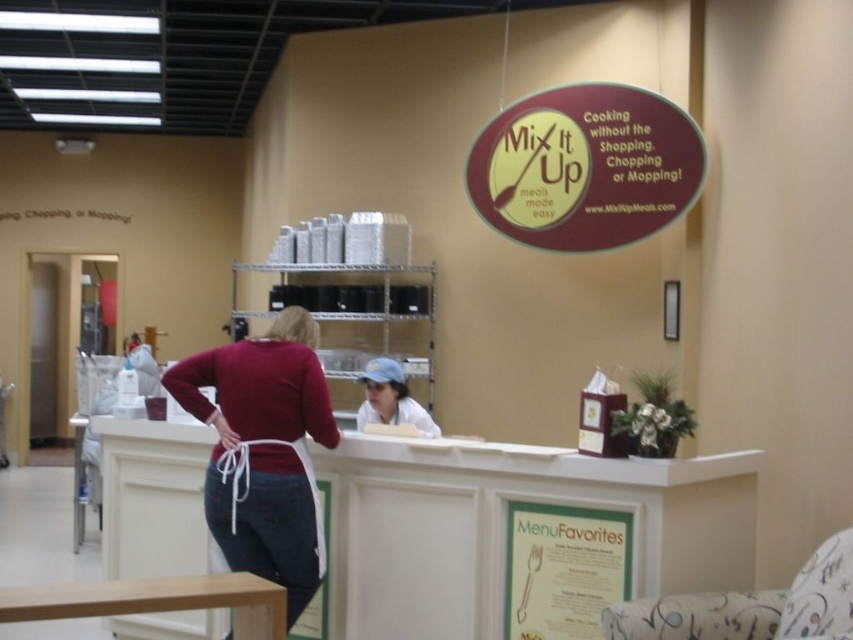
Question: Does white glossy counter at center appear on the left side of matte white apron at center?

Choices:
 (A) yes
 (B) no

Answer: (B)

Question: Does white glossy counter at center have a greater width compared to matte white apron at center?

Choices:
 (A) yes
 (B) no

Answer: (A)

Question: Which object is farther from the camera taking this photo?

Choices:
 (A) white glossy counter at center
 (B) matte white apron at center

Answer: (B)

Question: Which point is farther to the camera?

Choices:
 (A) (651, 460)
 (B) (268, 448)

Answer: (B)

Question: Considering the relative positions of white glossy counter at center and matte white apron at center in the image provided, where is white glossy counter at center located with respect to matte white apron at center?

Choices:
 (A) below
 (B) above

Answer: (A)